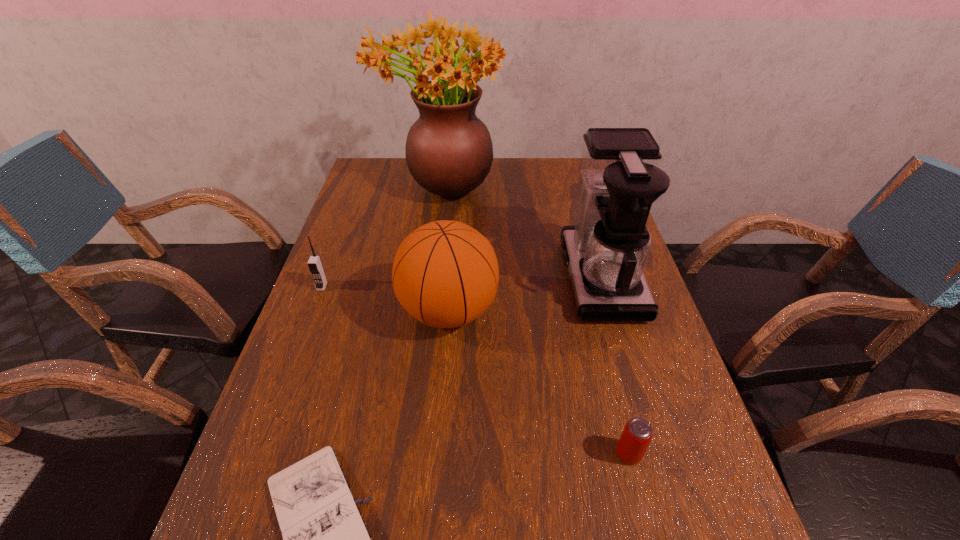
This screenshot has width=960, height=540. What are the coordinates of `vacant region that satisfies the following two spatial constraints: 1. on the front-facing side of the fourth tallest object; 2. on the left side of the second shortest object` in the screenshot? It's located at (259, 454).